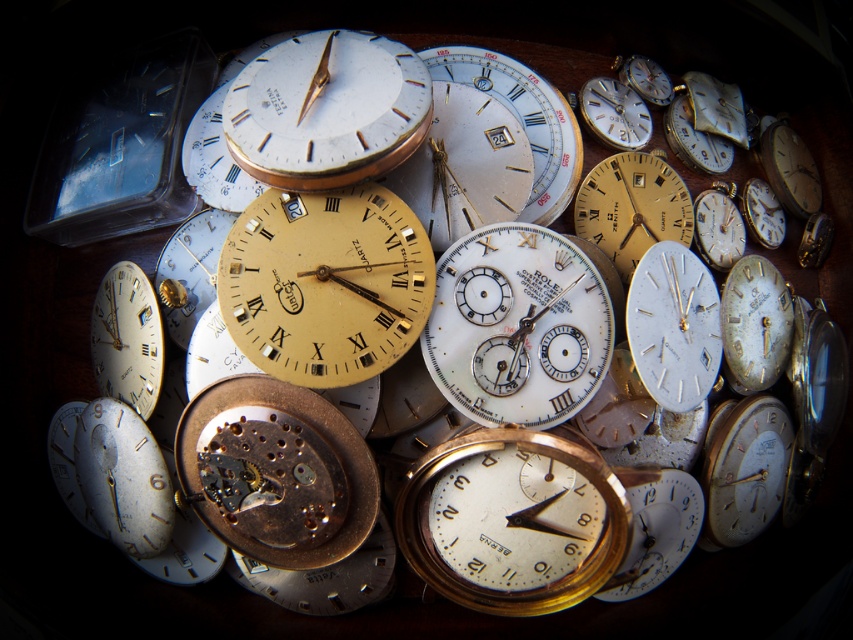
Question: Which point is farther to the camera?

Choices:
 (A) white metallic clock at center-right
 (B) white metallic watch face at center

Answer: (B)

Question: Is gold-plated pocket watch at center thinner than white metallic clock at center-right?

Choices:
 (A) yes
 (B) no

Answer: (B)

Question: Which point is farther to the camera?

Choices:
 (A) (97, 320)
 (B) (560, 449)

Answer: (A)

Question: Does gold metallic watch face at center appear on the right side of white metallic clock at center-right?

Choices:
 (A) no
 (B) yes

Answer: (A)

Question: Which point is closer to the camera?

Choices:
 (A) (606, 228)
 (B) (320, 301)

Answer: (B)

Question: Can you confirm if white metallic clock at center-right is bigger than white metallic watch face at center?

Choices:
 (A) yes
 (B) no

Answer: (A)